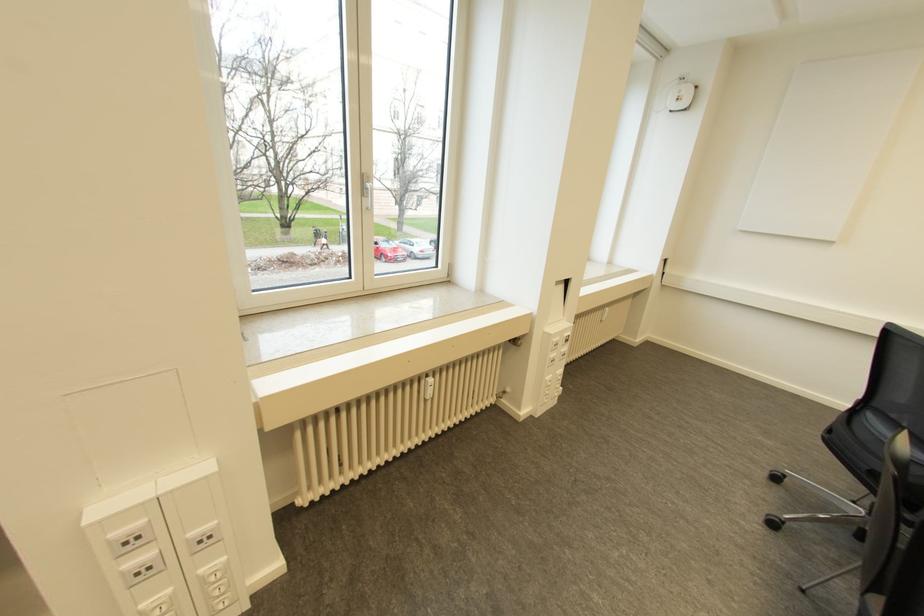
The width and height of the screenshot is (924, 616). What are the coordinates of `radiator thermostat` in the screenshot? It's located at (428, 387).